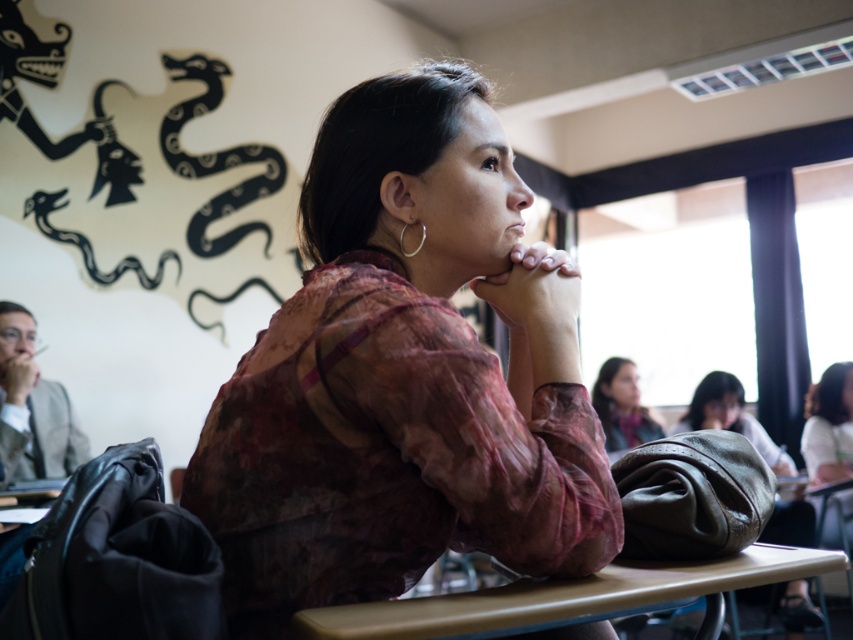
Measure the distance between smooth skin hands at center and camera.

92.17 centimeters

Does smooth skin hands at center have a greater height compared to smooth brown hair at upper right?

No.

Who is more forward, (x=497, y=304) or (x=637, y=424)?

Point (x=497, y=304) is more forward.

Identify the location of smooth skin hands at center. The height and width of the screenshot is (640, 853). (532, 291).

Consider the image. Is light brown plastic table at center to the right of smooth brown hair at upper right from the viewer's perspective?

In fact, light brown plastic table at center is to the left of smooth brown hair at upper right.

Identify the location of light brown plastic table at center. The height and width of the screenshot is (640, 853). (569, 596).

Identify the location of light brown plastic table at center. The image size is (853, 640). (569, 596).

Looking at this image, can you confirm if light brown plastic table at center is taller than leather bag at center?

No, light brown plastic table at center is not taller than leather bag at center.

Image resolution: width=853 pixels, height=640 pixels. Identify the location of light brown plastic table at center. (569, 596).

Locate an element on the screen. light brown plastic table at center is located at coordinates (569, 596).

Identify the location of light brown plastic table at center. (569, 596).